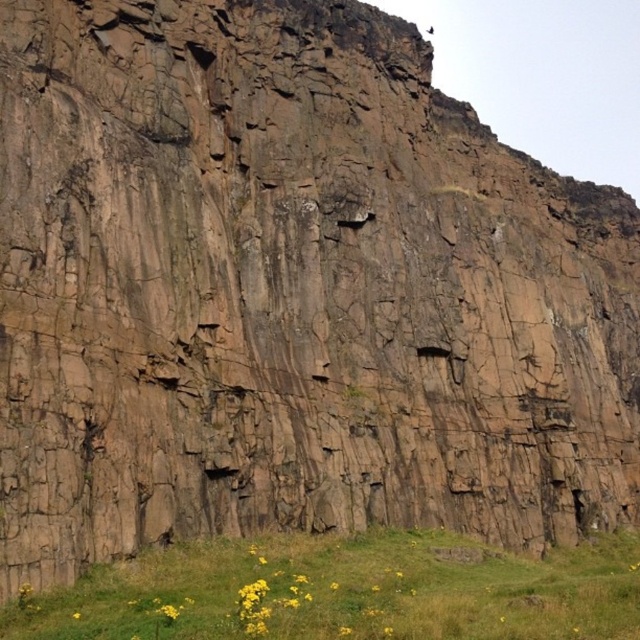
You are standing at the base of the massive rock formation and notice the green grass at lower center and the yellow matte flower at lower center. Which of these two elements is wider in terms of spatial coverage?

The green grass at lower center might be wider than yellow matte flower at lower center according to the description.

Based on the photo, you are a gardener who wants to plant a new flower in the grassy area. The flower requires at least 10 cm of space above it to grow properly. Given the current height of the green grass at lower center and yellow matte flower at lower center, will there be enough vertical space for the new flower to grow without being overshadowed?

The green grass at lower center is taller than the yellow matte flower at lower center. Since the grass is taller, planting a new flower that requires 10 cm of vertical space might not be sufficient as the grass could overshadow it. Consider trimming the grass or selecting a location with less dense vegetation.